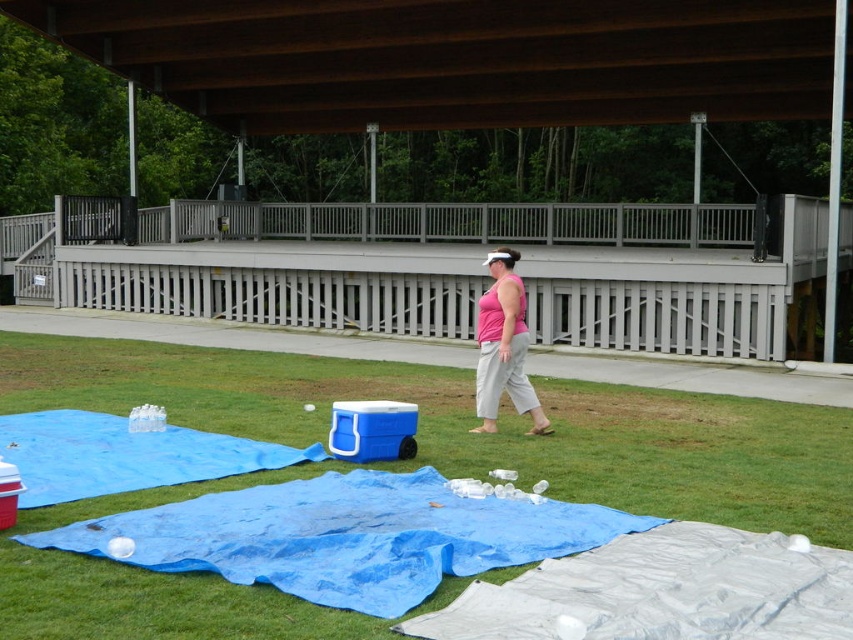
Between point (741, 403) and point (335, 532), which one is positioned behind?

Point (741, 403)

Which is more to the right, green grass at center or blue tarp at lower center?

blue tarp at lower center is more to the right.

Is point (468, 403) closer to camera compared to point (387, 548)?

No.

This screenshot has width=853, height=640. Find the location of `green grass at center`. green grass at center is located at coordinates (462, 432).

This screenshot has width=853, height=640. Describe the element at coordinates (346, 536) in the screenshot. I see `blue tarp at lower center` at that location.

This screenshot has height=640, width=853. Identify the location of blue tarp at lower center. (346, 536).

Does point (364, 506) lie behind point (485, 420)?

That is False.

Find the location of a particular element. blue tarp at lower center is located at coordinates (346, 536).

Is green grass at center taller than pink matte tank top at center?

No.

Describe the element at coordinates (462, 432) in the screenshot. I see `green grass at center` at that location.

Consider the image. Who is more distant from viewer, [683,442] or [511,259]?

The point [511,259] is more distant.

Image resolution: width=853 pixels, height=640 pixels. Identify the location of green grass at center. (462, 432).